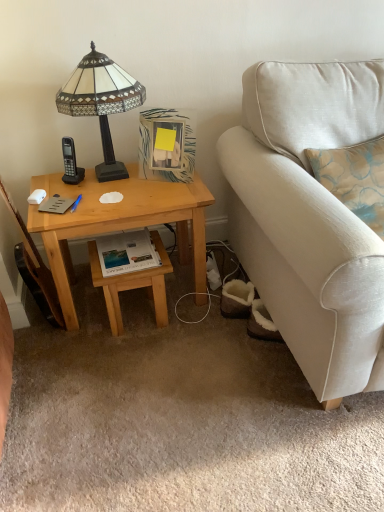
What are the coordinates of `free space above white glossy book at center (from a real-world perspective)` in the screenshot? It's located at (132, 248).